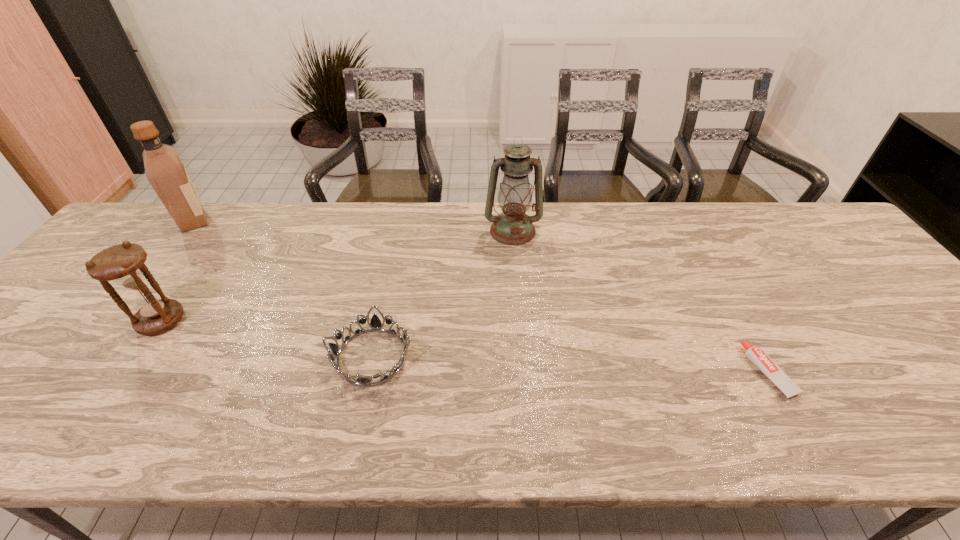
Where is `vacant space located on the front-facing side of the fourth tallest object`? The width and height of the screenshot is (960, 540). vacant space located on the front-facing side of the fourth tallest object is located at coordinates (507, 356).

The image size is (960, 540). In order to click on free spot located on the right of the shortest object in this screenshot , I will do `click(900, 372)`.

Identify the location of liquor that is at the far edge. This screenshot has width=960, height=540. click(x=164, y=169).

Identify the location of oil lamp positioned at the far edge. (512, 226).

Where is `object positioned at the left edge`? object positioned at the left edge is located at coordinates coord(164,169).

Identify the location of object that is at the far left corner. This screenshot has width=960, height=540. (164, 169).

Locate an element on the screen. This screenshot has width=960, height=540. free location at the far edge is located at coordinates (263, 206).

Find the location of `vacant space at the near edge of the desktop`. vacant space at the near edge of the desktop is located at coordinates (417, 435).

Locate an element on the screen. The width and height of the screenshot is (960, 540). free region at the far right corner of the desktop is located at coordinates (777, 204).

Identify the location of empty space between the fourth object from left to right and the tiara. (443, 294).